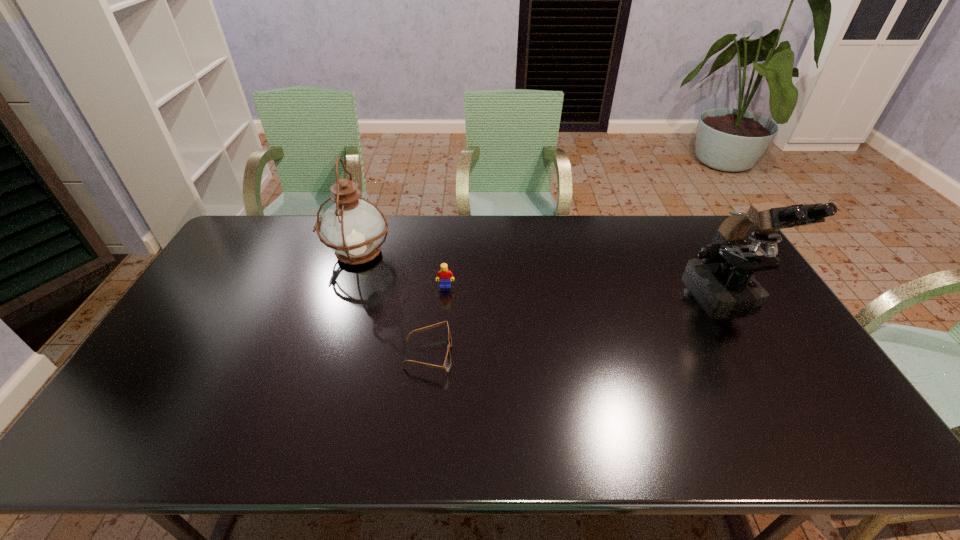
Locate an element on the screen. microscope is located at coordinates (723, 271).

Where is `oil lamp`? oil lamp is located at coordinates (353, 228).

Locate an element on the screen. This screenshot has width=960, height=540. the second shortest object is located at coordinates (444, 274).

This screenshot has height=540, width=960. Identify the location of sunglasses. (447, 363).

Identify the location of the nearest object. (447, 363).

At what (x,y) coordinates should I click in order to perform the action: click on vacant space situated on the front of the microscope. Please return your answer as a coordinate pair (x, y). This screenshot has height=540, width=960. Looking at the image, I should click on (785, 390).

At what (x,y) coordinates should I click in order to perform the action: click on free space located on the right of the oil lamp. Please return your answer as a coordinate pair (x, y). This screenshot has height=540, width=960. Looking at the image, I should click on (444, 254).

Where is `vacant space located 0.400m on the face of the Lego`? vacant space located 0.400m on the face of the Lego is located at coordinates (436, 399).

At what (x,y) coordinates should I click in order to perform the action: click on vacant space located 0.310m on the frames of the sunglasses. Please return your answer as a coordinate pair (x, y). The height and width of the screenshot is (540, 960). Looking at the image, I should click on (565, 354).

This screenshot has height=540, width=960. In order to click on object that is positioned at the far edge in this screenshot , I will do `click(353, 228)`.